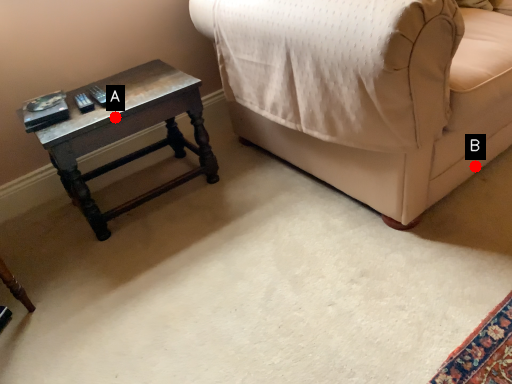
Question: Two points are circled on the image, labeled by A and B beside each circle. Which point is further to the camera?

Choices:
 (A) A is further
 (B) B is further

Answer: (B)